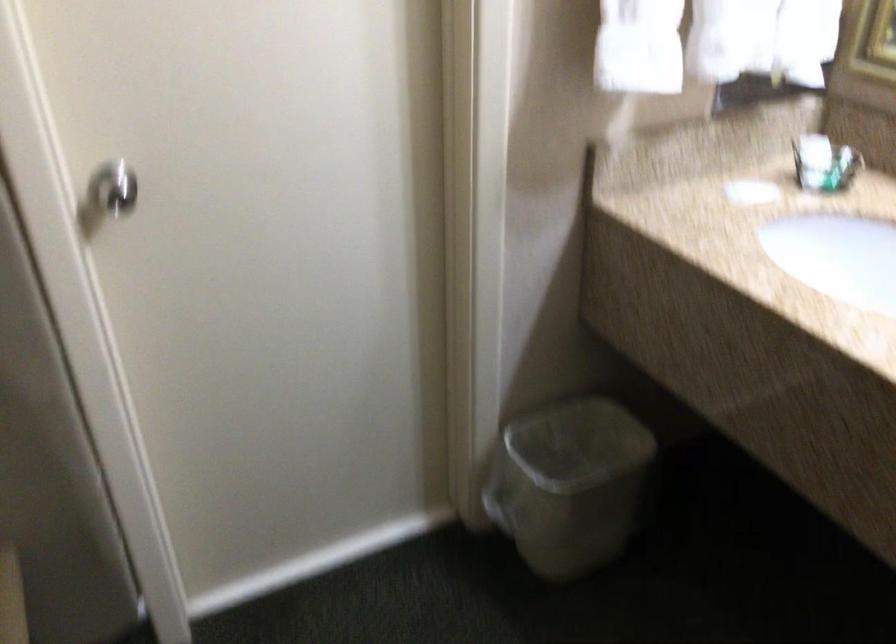
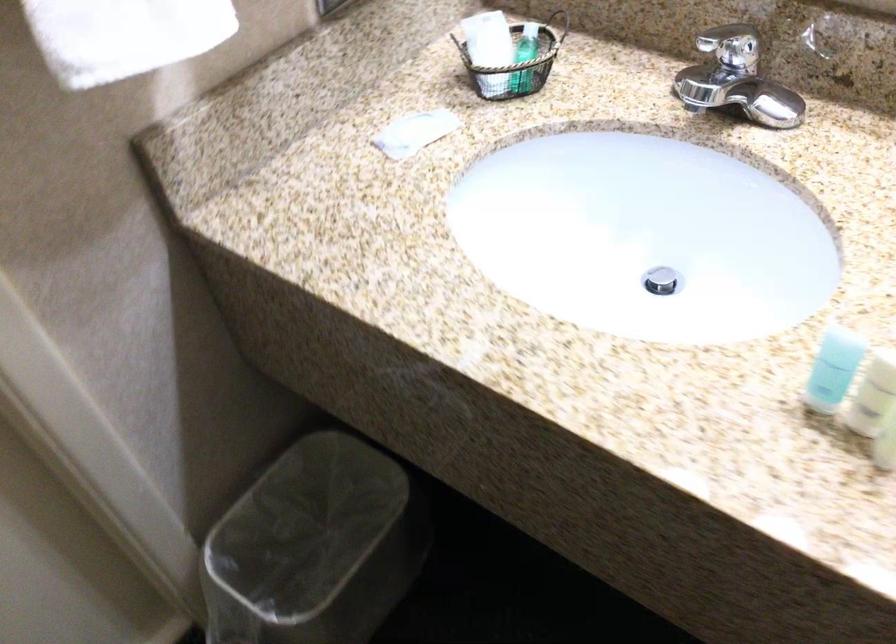
The first image is from the beginning of the video and the second image is from the end. How did the camera likely rotate when shooting the video?

The rotation direction of the camera is right-down.